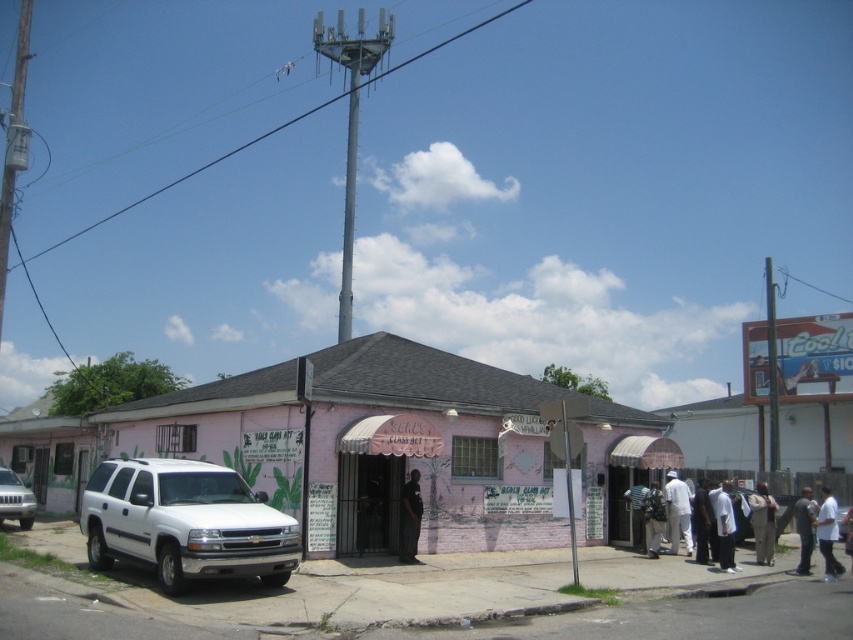
Question: Considering the real-world distances, which object is closest to the white matte suv at lower left?

Choices:
 (A) black matte shirt at center
 (B) white cotton shirt at lower right
 (C) metallic gray pole at upper center

Answer: (A)

Question: Which object is farther from the camera taking this photo?

Choices:
 (A) dark gray pants at center
 (B) white cotton shirt at center

Answer: (A)

Question: Which of the following is the closest to the observer?

Choices:
 (A) (679, 490)
 (B) (399, 524)
 (C) (563, 400)

Answer: (B)

Question: From the image, what is the correct spatial relationship of white matte suv at lower left in relation to dark gray pants at center?

Choices:
 (A) above
 (B) below

Answer: (A)

Question: Is white matte suv at left bigger than metallic gray pole at center?

Choices:
 (A) no
 (B) yes

Answer: (A)

Question: Can you confirm if metallic gray pole at upper center is wider than black matte shirt at center?

Choices:
 (A) no
 (B) yes

Answer: (B)